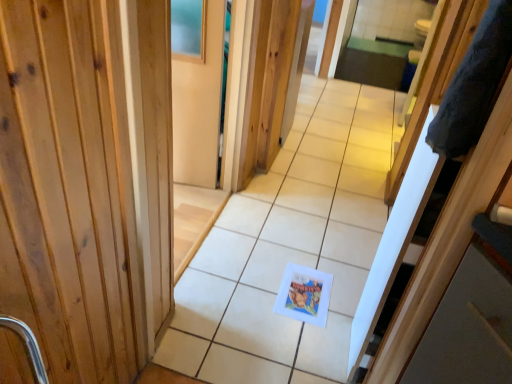
Question: Is white paper at center situated inside wooden at center or outside?

Choices:
 (A) inside
 (B) outside

Answer: (B)

Question: From a real-world perspective, is white paper at center above or below wooden at center?

Choices:
 (A) above
 (B) below

Answer: (A)

Question: Which object is positioned farthest from the wooden at center?

Choices:
 (A) gray fluffy robe at right
 (B) white matte postcard at center
 (C) white paper at center
 (D) matte wood screen door at upper center

Answer: (A)

Question: Estimate the real-world distances between objects in this image. Which object is farther from the matte wood screen door at upper center?

Choices:
 (A) gray fluffy robe at right
 (B) white paper at center
 (C) white matte postcard at center
 (D) wooden at center

Answer: (A)